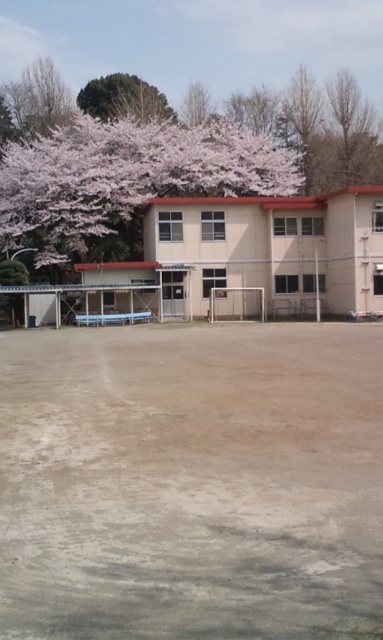
You are standing at the entrance of the building and want to walk to the green leafy tree at upper center. Which direction should you turn to avoid walking over the brown sandy dirt field at center?

You should turn left to avoid walking over the brown sandy dirt field at center because the brown sandy dirt field at center is to the right of the green leafy tree at upper center, so turning left would lead you towards the tree without crossing the field.

You are standing in the outdoor scene and want to know how far the point at coordinates (142, 173) is from you. Can you determine the distance?

The point at coordinates (142, 173) is 153.79 feet away from the viewer.